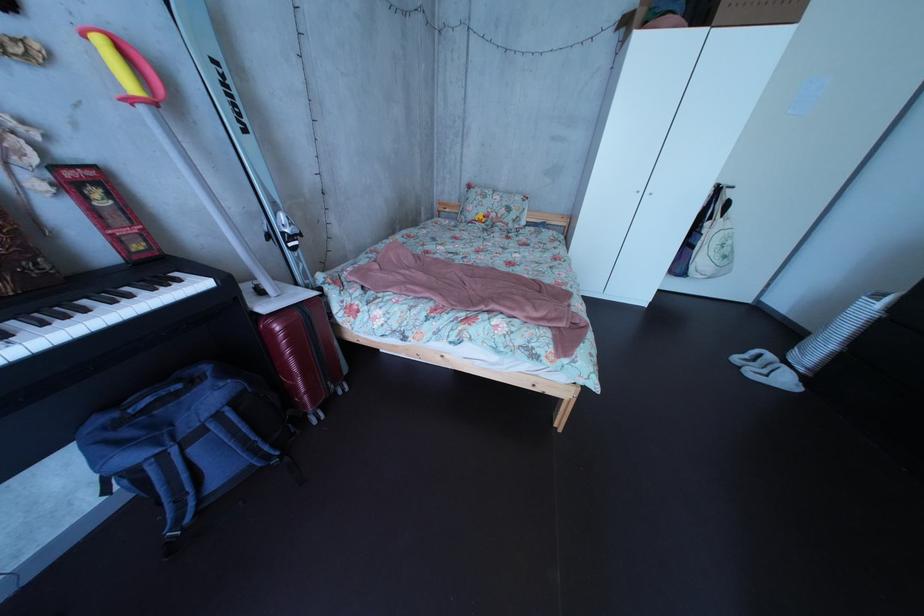
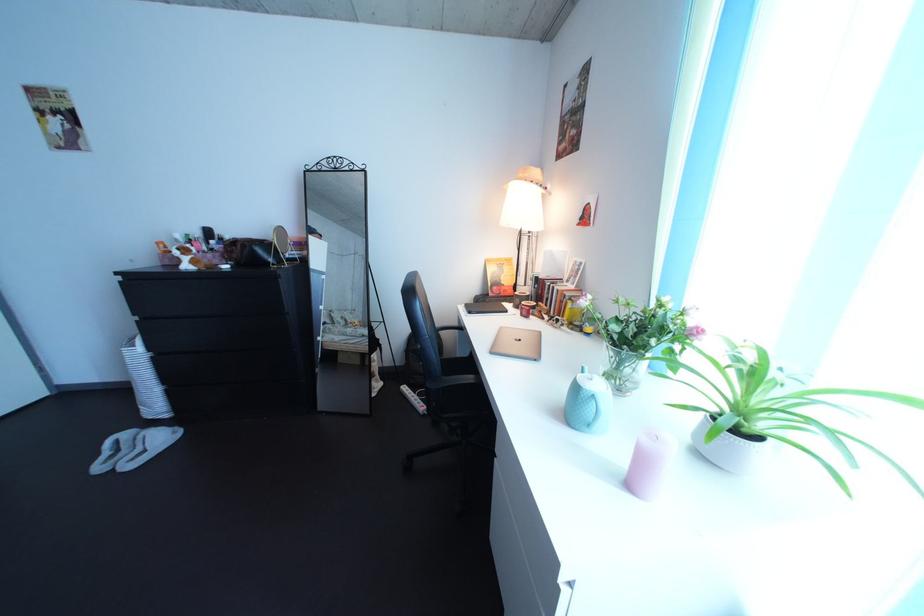
The images are taken continuously from a first-person perspective. In which direction is your viewpoint rotating?

The rotation direction of the camera is right-down.